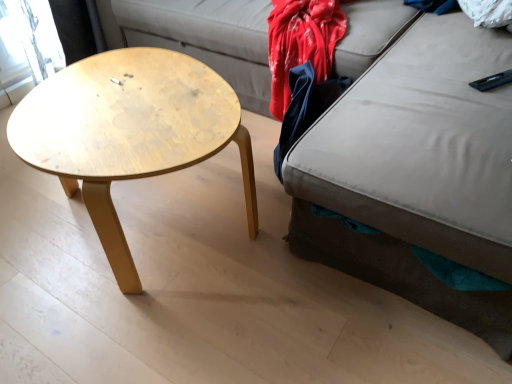
Identify the location of vacant space underneath natural wood coffee table at left (from a real-world perspective). (157, 234).